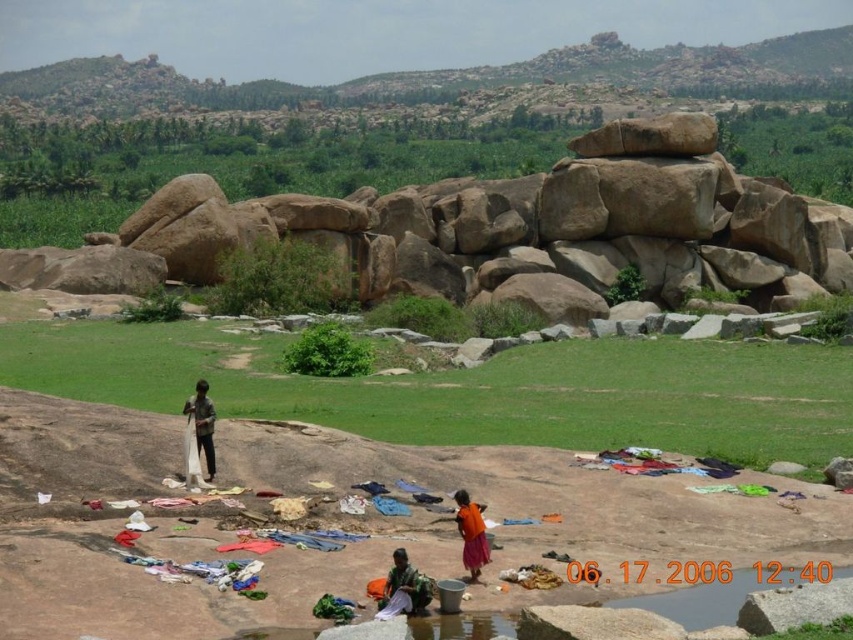
You are a traveler who wants to hang the orange cotton dress at center to dry. You see the white cotton cloth at lower center. Can you place the dress on top of the cloth?

The white cotton cloth at lower center is positioned under the orange cotton dress at center, so yes, you can place the dress on top of the cloth since the cloth is already underneath it.

What is located at the coordinates point (x=202, y=422) in the image?

The point (x=202, y=422) indicates dark brown fabric at center.